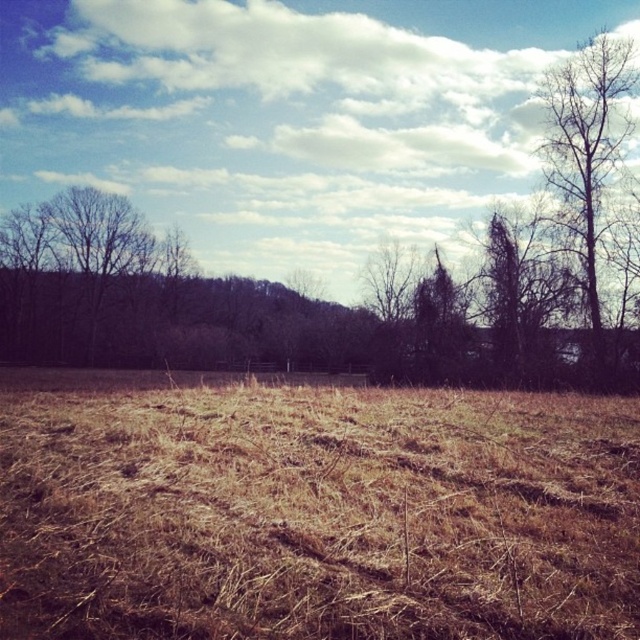
Question: Does brown dry grass at center appear on the left side of bare branches at right?

Choices:
 (A) no
 (B) yes

Answer: (B)

Question: Can you confirm if brown dry grass at center is positioned to the right of bare branches at right?

Choices:
 (A) yes
 (B) no

Answer: (B)

Question: Among these objects, which one is farthest from the camera?

Choices:
 (A) bare branches at right
 (B) brown dry grass at center

Answer: (A)

Question: Can you confirm if brown dry grass at center is positioned to the left of bare branches at right?

Choices:
 (A) no
 (B) yes

Answer: (B)